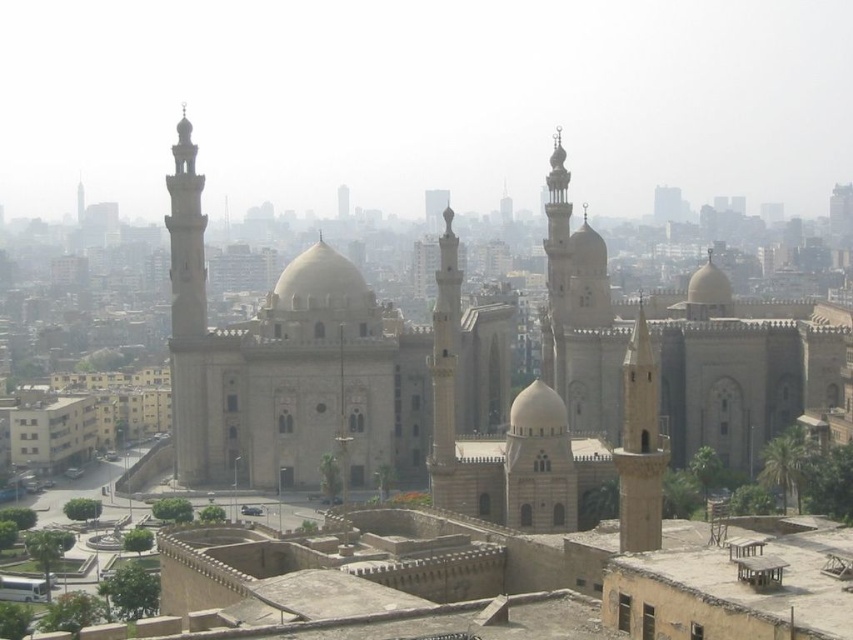
You are standing in front of the historic mosque complex and notice two minarets. The beige stone minaret at center right and the light beige stone minaret at left. Which minaret is positioned lower in the image?

The beige stone minaret at center right is positioned lower than the light beige stone minaret at left in the image.